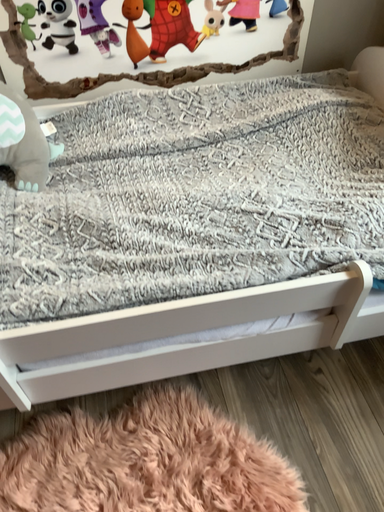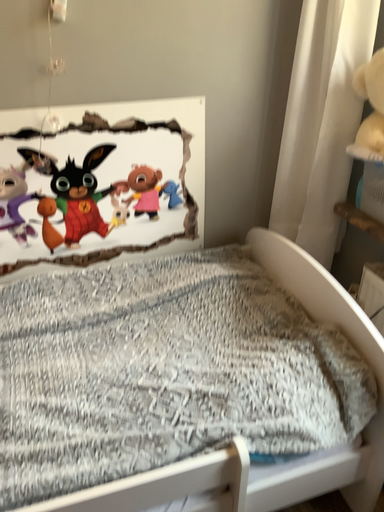
Question: How did the camera likely rotate when shooting the video?

Choices:
 (A) rotated upward
 (B) rotated downward

Answer: (A)